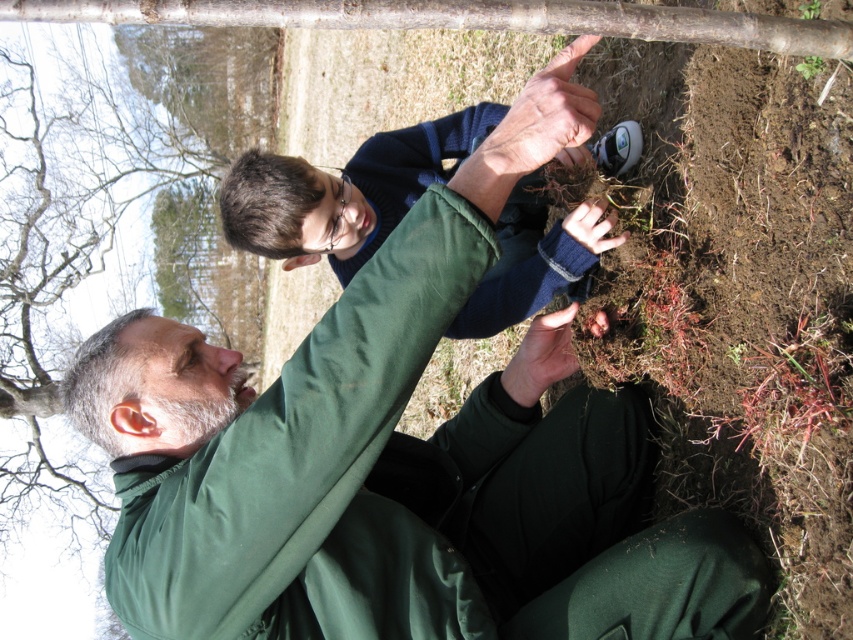
Question: Which point is farther to the camera?

Choices:
 (A) green matte jacket at center
 (B) dark blue sweater at upper center

Answer: (B)

Question: Which of the following is the farthest from the observer?

Choices:
 (A) (364, 621)
 (B) (572, 248)

Answer: (B)

Question: Does green matte tree at upper center have a larger size compared to dark blue sweater at upper center?

Choices:
 (A) yes
 (B) no

Answer: (A)

Question: Estimate the real-world distances between objects in this image. Which object is closer to the dark blue sweater at upper center?

Choices:
 (A) green matte jacket at center
 (B) green matte tree at upper center

Answer: (A)

Question: In this image, where is green matte tree at upper center located relative to dark blue sweater at upper center?

Choices:
 (A) below
 (B) above

Answer: (B)

Question: Is green matte jacket at center positioned at the back of green matte tree at upper center?

Choices:
 (A) yes
 (B) no

Answer: (B)